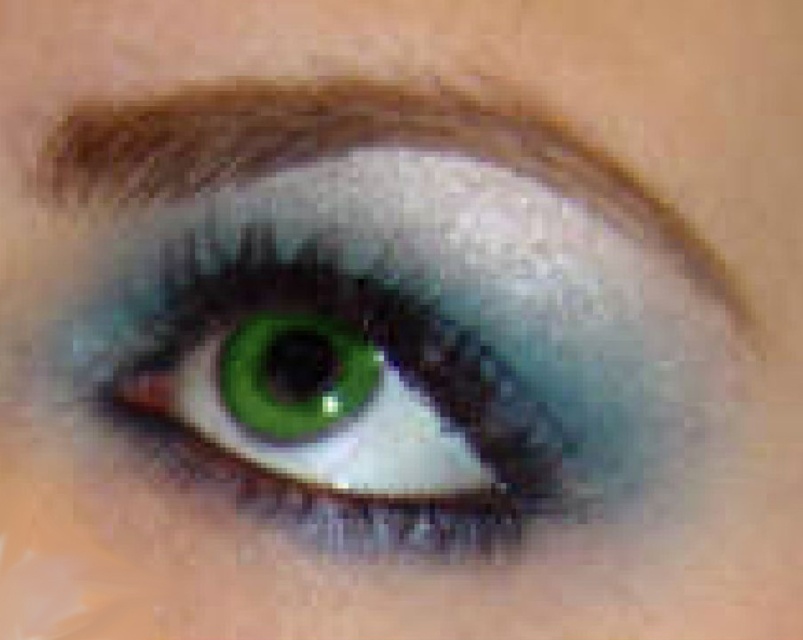
You are an artist trying to replicate the eye structure in the image. Which of the following statements is true about the green matte eye at center and the teal matte eye at center?

The green matte eye at center is much taller than the teal matte eye at center.

You are a makeup artist preparing to apply eyeliner. You have the brown matte eyebrow at upper left and the teal matte eye at center in view. Which object is located above the other?

The brown matte eyebrow at upper left is positioned over the teal matte eye at center, meaning it is above it.

You are a makeup artist preparing to apply eyeliner between the brown matte eyebrow at upper left and the teal matte eye at center. The eyeliner pencil you are using can only draw a line up to 2 inches long. Based on the image, will the pencil be long enough to connect the two areas?

The brown matte eyebrow at upper left and teal matte eye at center are 2.33 inches apart from each other. Since the eyeliner pencil can only draw up to 2 inches, it will not be long enough to connect the two areas.